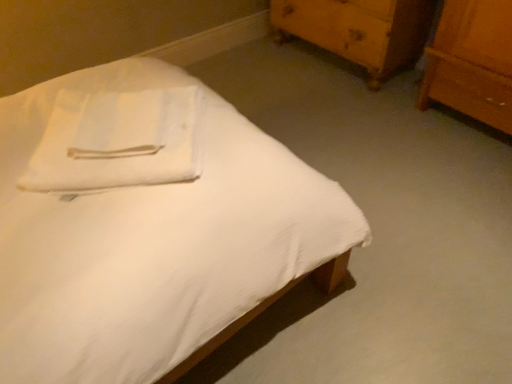
Question: Considering the positions of white matte bed at center and wooden chest of drawers at upper right in the image, is white matte bed at center bigger or smaller than wooden chest of drawers at upper right?

Choices:
 (A) big
 (B) small

Answer: (A)

Question: In terms of width, does white matte bed at center look wider or thinner when compared to wooden chest of drawers at upper right?

Choices:
 (A) wide
 (B) thin

Answer: (A)

Question: Estimate the real-world distances between objects in this image. Which object is farther from the white matte bed at center?

Choices:
 (A) white cotton towel at upper left
 (B) wooden chest of drawers at upper right

Answer: (B)

Question: Which object is the closest to the wooden chest of drawers at upper right?

Choices:
 (A) white cotton towel at upper left
 (B) white matte bed at center

Answer: (B)